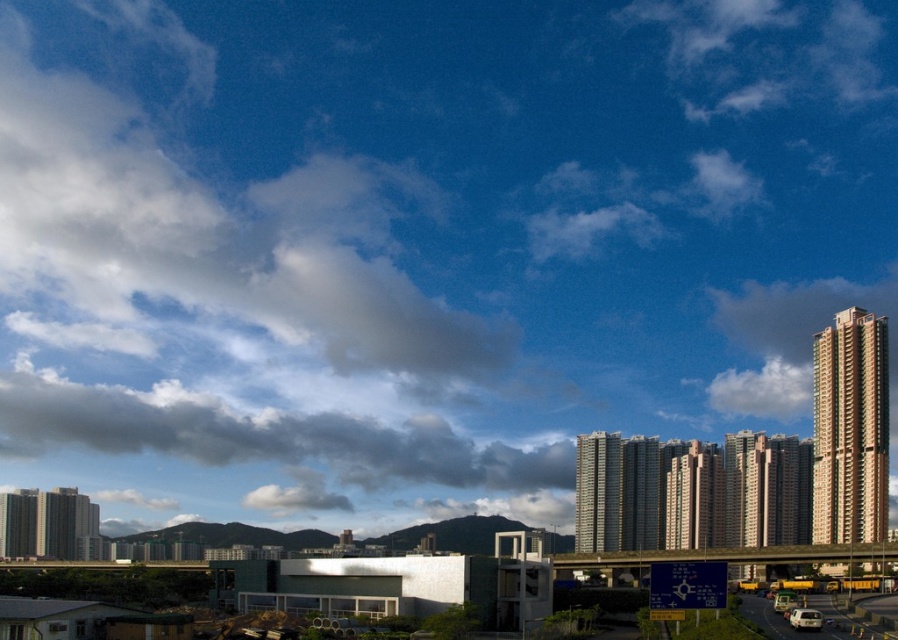
Question: Does greenish-brown concrete building at right have a greater width compared to white matte car at lower right?

Choices:
 (A) yes
 (B) no

Answer: (A)

Question: Which of the following is the farthest from the observer?

Choices:
 (A) (619, 483)
 (B) (750, 552)
 (C) (767, 621)

Answer: (A)

Question: Can you confirm if yellow metallic highway at lower right is positioned to the right of white matte car at lower right?

Choices:
 (A) yes
 (B) no

Answer: (A)

Question: Among these points, which one is nearest to the camera?

Choices:
 (A) coord(591,516)
 (B) coord(895,336)

Answer: (B)

Question: Among these points, which one is nearest to the camera?

Choices:
 (A) (257, 484)
 (B) (816, 611)
 (C) (759, 340)
 (D) (729, 560)

Answer: (B)

Question: Can you confirm if dark gray cloud at upper left is bigger than white fluffy cloud at upper right?

Choices:
 (A) no
 (B) yes

Answer: (B)